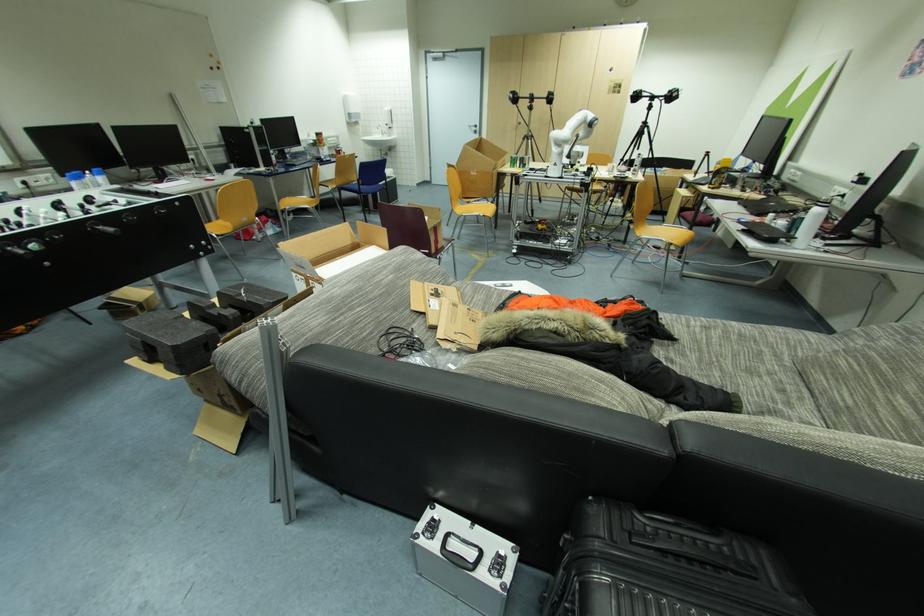
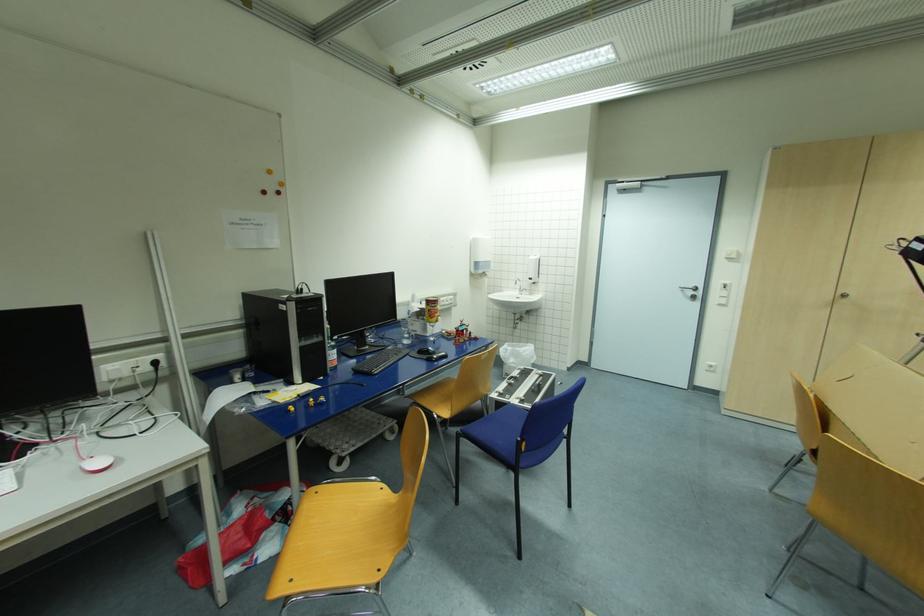
In the second image, find the point that corresponds to (523,124) in the first image.

(847, 296)